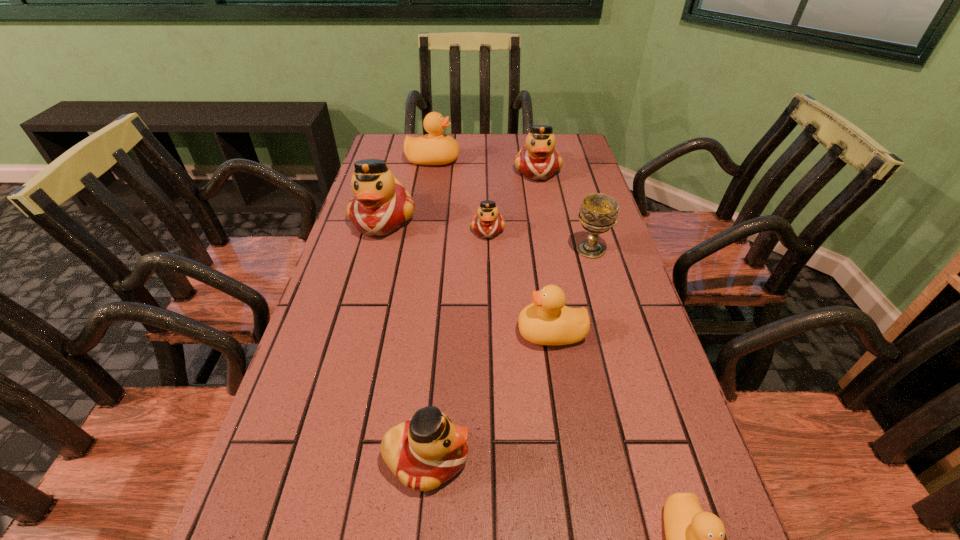
This screenshot has width=960, height=540. I want to click on the tallest object, so click(x=380, y=205).

Locate an element on the screen. The width and height of the screenshot is (960, 540). the biggest red duck is located at coordinates (380, 205).

Identify the location of the rightmost red duck. (538, 160).

The height and width of the screenshot is (540, 960). In order to click on the second biggest red duck in this screenshot , I will do `click(538, 160)`.

This screenshot has height=540, width=960. I want to click on the leftmost yellow duck, so click(435, 148).

In order to click on the biggest yellow duck in this screenshot , I will do `click(435, 148)`.

The width and height of the screenshot is (960, 540). What are the coordinates of `chalice` in the screenshot? It's located at (598, 213).

Identify the location of the second nearest duck. The image size is (960, 540). (427, 450).

Find the location of a particular element. This screenshot has width=960, height=540. the second smallest red duck is located at coordinates (427, 450).

Identify the location of the second nearest yellow duck. The height and width of the screenshot is (540, 960). (547, 321).